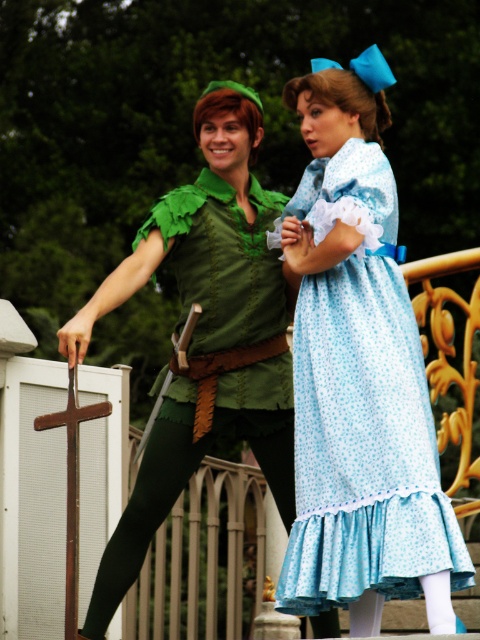
You are a costume designer preparing for a play. You have two light blue floral dresses. The first is the light blue floral fabric dress at right, and the second is the light blue floral dress at center. Which dress has a wider width according to the image?

The light blue floral dress at center has a wider width than the light blue floral fabric dress at right.

You are a costume designer observing the scene. You need to determine which costume element is taller between the light blue floral dress at center and the green felt tights at lower left. Based on the scene, which one is taller?

The light blue floral dress at center is taller than the green felt tights at lower left according to the description.

You are a photographer trying to capture a group photo of the light blue floral fabric dress at right and the green felt tights at lower left. Since you want to include both subjects in the frame, which direction should you move your camera to ensure both are visible?

The light blue floral fabric dress at right is to the right of green felt tights at lower left, so you should move your camera to the left to ensure both are visible.